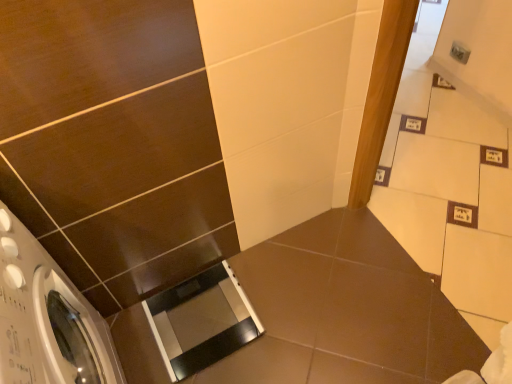
I want to click on vacant space to the right of transparent plastic screen door at lower center, so click(284, 306).